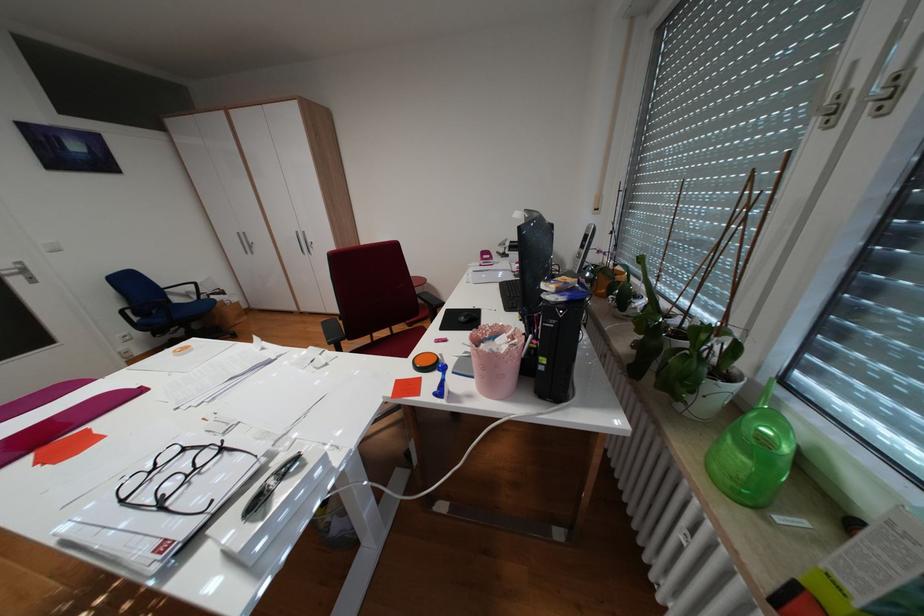
You are a GUI agent. You are given a task and a screenshot of the screen. Output one action in this format:
    pyautogui.click(x=<x>, y=<y>)
    Task: Click on the blue chair armrest
    The width and height of the screenshot is (924, 616).
    Given the screenshot: What is the action you would take?
    pyautogui.click(x=185, y=288)